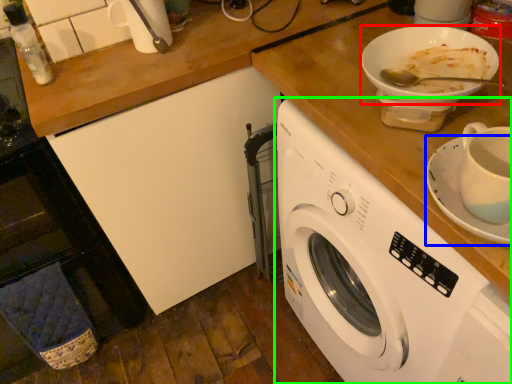
Question: Which is farther away from tableware (highlighted by a red box)? saucer (highlighted by a blue box) or washing machine (highlighted by a green box)?

Choices:
 (A) saucer
 (B) washing machine

Answer: (B)